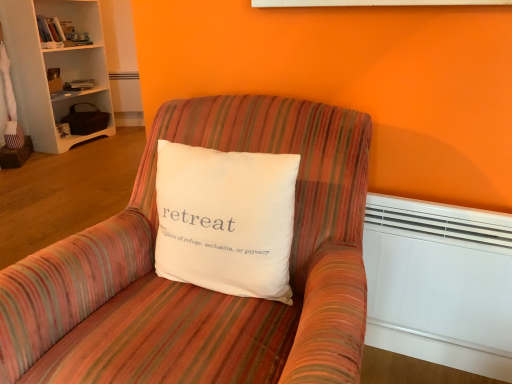
Question: Looking at the image, does white plastic heater at lower right seem bigger or smaller compared to white wood bookcase at upper left?

Choices:
 (A) big
 (B) small

Answer: (B)

Question: Is white plastic heater at lower right inside the boundaries of white wood bookcase at upper left, or outside?

Choices:
 (A) inside
 (B) outside

Answer: (B)

Question: Estimate the real-world distances between objects in this image. Which object is closer to the striped fabric chair at center?

Choices:
 (A) white wood bookcase at upper left
 (B) white cotton pillow at center
 (C) white plastic heater at lower right

Answer: (B)

Question: Which is nearer to the white wood bookcase at upper left?

Choices:
 (A) white plastic heater at lower right
 (B) striped fabric chair at center
 (C) white cotton pillow at center

Answer: (B)